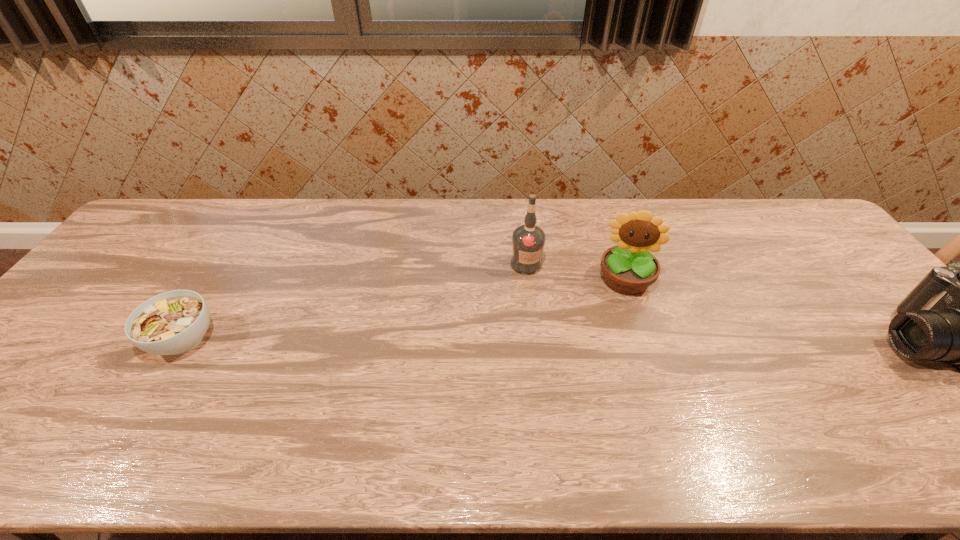
Locate an element on the screen. vacant space on the desktop that is between the leftmost object and the rightmost object and is positioned on the front label of the vodka is located at coordinates (594, 341).

This screenshot has height=540, width=960. Identify the location of free spot on the desktop that is between the shortest object and the third tallest object and is positioned on the face of the sunflower. (621, 341).